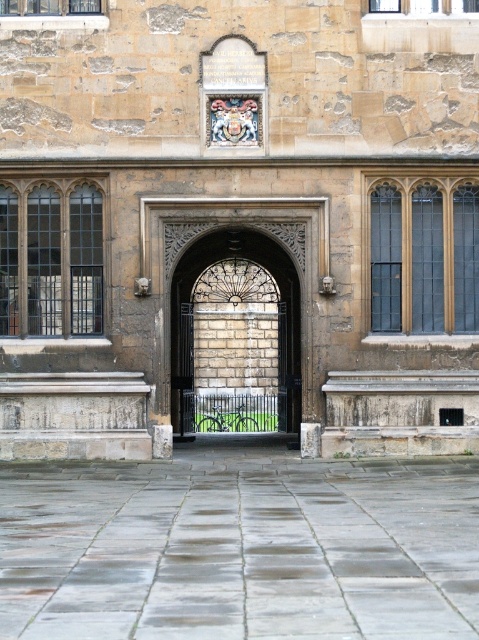
You are a tour guide explaining the entrance of this historic building to a group. You mention both the dark brown stone gate at center and the clear glass window at upper center. Which of these two features is larger in size?

The clear glass window at upper center is larger than the dark brown stone gate at center.

You are standing at the entrance of the historic building and want to find the dark brown wooden window at left. Based on the coordinates given, where should you look relative to the entrance?

The dark brown wooden window at left is located at coordinates point (50, 260), which means it is positioned to the left and slightly above the center of the entrance.

You are a window installer assessing the entrance of a historic building. You need to replace the smaller window. Which window should you choose between the dark brown wooden window at left and the clear glass window at upper center?

The clear glass window at upper center is smaller than the dark brown wooden window at left, so you should choose the clear glass window at upper center to replace the smaller one.